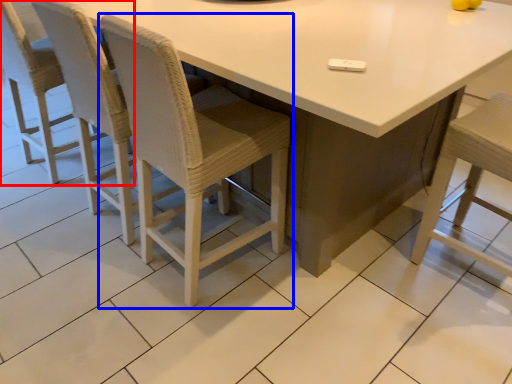
Question: Which object is closer to the camera taking this photo, chair (highlighted by a red box) or chair (highlighted by a blue box)?

Choices:
 (A) chair
 (B) chair

Answer: (B)